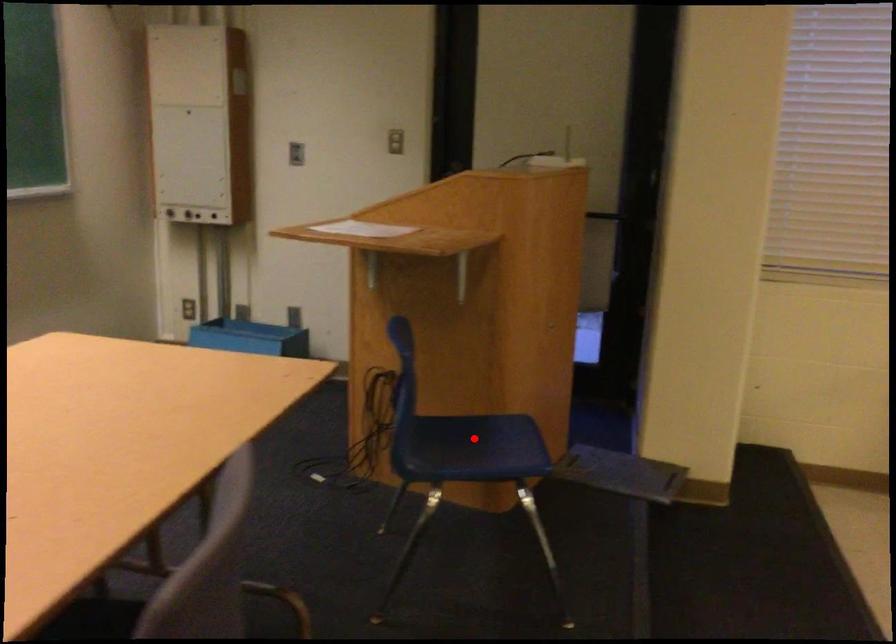
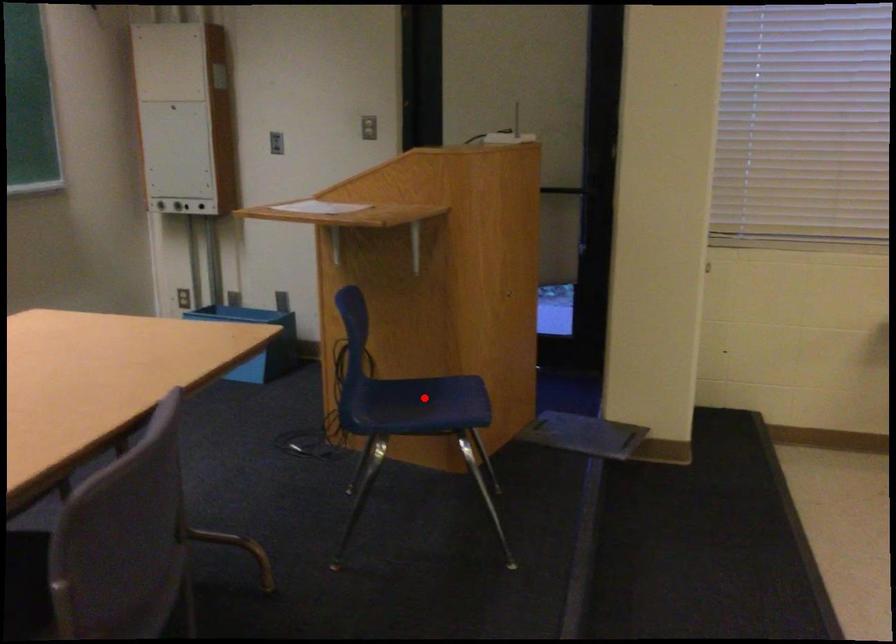
I am providing you with two images of the same scene from different viewpoints. A red point is marked on the first image and another point is marked on the second image. Is the red point in image1 aligned with the point shown in image2?

Yes